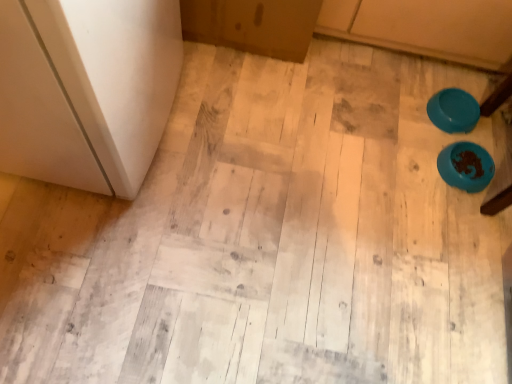
You are a GUI agent. You are given a task and a screenshot of the screen. Output one action in this format:
    pyautogui.click(x=<x>, y=<y>)
    Task: Click on the vacant space that is in between teal glossy bowl at upper right, which is the 2th bowl in bottom-to-top order, and blue plastic bowl at lower right, which appears as the second bowl when viewed from the top
    
    Given the screenshot: What is the action you would take?
    pyautogui.click(x=455, y=139)